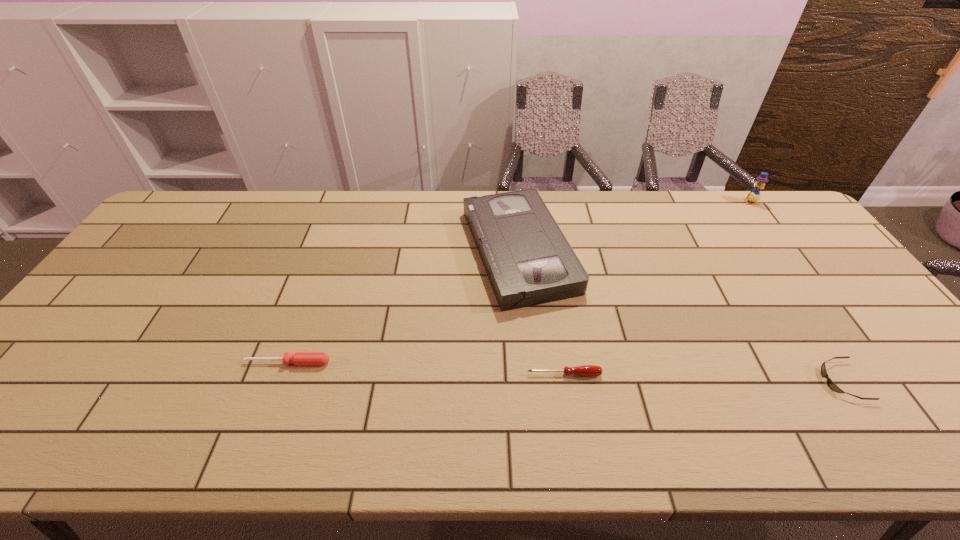
Find the location of `unoccupied area between the videotape and the farther screwdriver`. unoccupied area between the videotape and the farther screwdriver is located at coordinates [403, 307].

Where is `free spot between the nearer screwdriver and the fourth shortest object`? This screenshot has height=540, width=960. free spot between the nearer screwdriver and the fourth shortest object is located at coordinates (541, 313).

This screenshot has height=540, width=960. Identify the location of blank region between the shortest object and the nearer screwdriver. (703, 377).

At what (x,y) coordinates should I click in order to perform the action: click on the fourth closest object relative to the leftmost object. Please return your answer as a coordinate pair (x, y). This screenshot has height=540, width=960. Looking at the image, I should click on (754, 195).

Identify which object is the second closest to the left screwdriver. Please provide its 2D coordinates. Your answer should be formatted as a tuple, i.e. [(x, y)], where the tuple contains the x and y coordinates of a point satisfying the conditions above.

[(587, 370)]